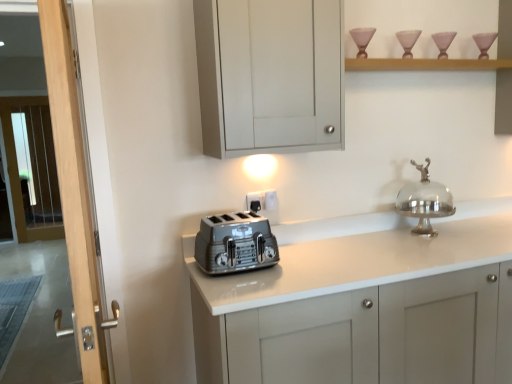
Question: Considering the relative sizes of clear glass screen door at left, placed as the 1th screen door when sorted from left to right, and silver metallic cake stand at upper right in the image provided, is clear glass screen door at left, placed as the 1th screen door when sorted from left to right, taller than silver metallic cake stand at upper right?

Choices:
 (A) no
 (B) yes

Answer: (B)

Question: Is clear glass screen door at left, the second screen door when ordered from right to left, looking in the opposite direction of silver metallic cake stand at upper right?

Choices:
 (A) yes
 (B) no

Answer: (B)

Question: Is the position of clear glass screen door at left, the 2th screen door from the front, less distant than that of silver metallic cake stand at upper right?

Choices:
 (A) no
 (B) yes

Answer: (A)

Question: Is clear glass screen door at left, placed as the 1th screen door when sorted from left to right, not within silver metallic cake stand at upper right?

Choices:
 (A) no
 (B) yes

Answer: (B)

Question: Is clear glass screen door at left, placed as the 1th screen door when sorted from left to right, at the right side of silver metallic cake stand at upper right?

Choices:
 (A) no
 (B) yes

Answer: (A)

Question: Does clear glass screen door at left, which is the 1th screen door in back-to-front order, appear on the left side of silver metallic cake stand at upper right?

Choices:
 (A) no
 (B) yes

Answer: (B)

Question: Does clear glass screen door at left, which is the 1th screen door in back-to-front order, appear on the right side of wooden screen door at left, the 1th screen door positioned from the right?

Choices:
 (A) yes
 (B) no

Answer: (B)

Question: Is there a large distance between clear glass screen door at left, the second screen door when ordered from right to left, and wooden screen door at left, the 1th screen door positioned from the right?

Choices:
 (A) no
 (B) yes

Answer: (B)

Question: Is clear glass screen door at left, which is the 1th screen door in back-to-front order, closer to the viewer compared to wooden screen door at left, the 1th screen door positioned from the right?

Choices:
 (A) yes
 (B) no

Answer: (B)

Question: Is wooden screen door at left, the 1th screen door positioned from the right, at the back of clear glass screen door at left, placed as the 1th screen door when sorted from left to right?

Choices:
 (A) no
 (B) yes

Answer: (A)

Question: From the image's perspective, would you say clear glass screen door at left, placed as the 1th screen door when sorted from left to right, is shown under wooden screen door at left, arranged as the first screen door when viewed from the front?

Choices:
 (A) yes
 (B) no

Answer: (B)

Question: Is clear glass screen door at left, which is the 1th screen door in back-to-front order, placed right next to wooden screen door at left, the second screen door from the left?

Choices:
 (A) no
 (B) yes

Answer: (A)

Question: Considering the relative sizes of matte black outlet at center, acting as the first electric outlet starting from the left, and matte gray cabinet at upper center in the image provided, is matte black outlet at center, acting as the first electric outlet starting from the left, thinner than matte gray cabinet at upper center?

Choices:
 (A) no
 (B) yes

Answer: (B)